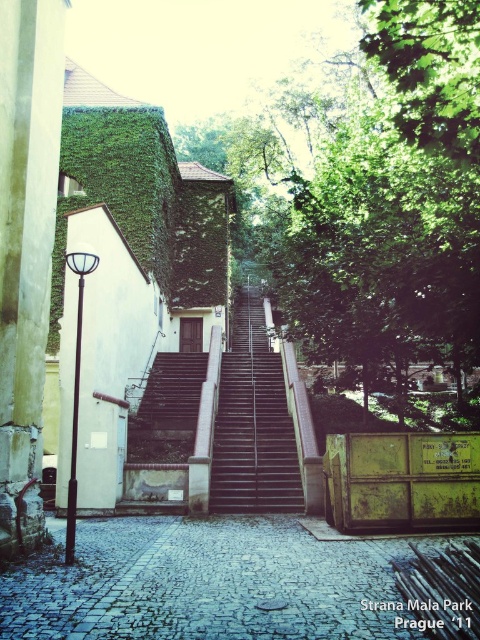
Looking at this image, you are standing at the bottom of the wide stone stairs in Strana Mala Park, Prague, and you see two points marked on the scene. The first point is at coordinate (269,225), and the second point is at (245,504). Which point is closer to you?

Point (269,225) is further to the viewer than point (245,504), so the second point at (245,504) is closer to you.

You are a tourist in Prague and want to take a photo of the black metal stairs at center and the cobblestone alley at center. Which one should you zoom in on more to capture both in the frame?

The cobblestone alley at center is smaller than the black metal stairs at center, so you should zoom in more on the cobblestone alley at center to ensure both fit in the frame.